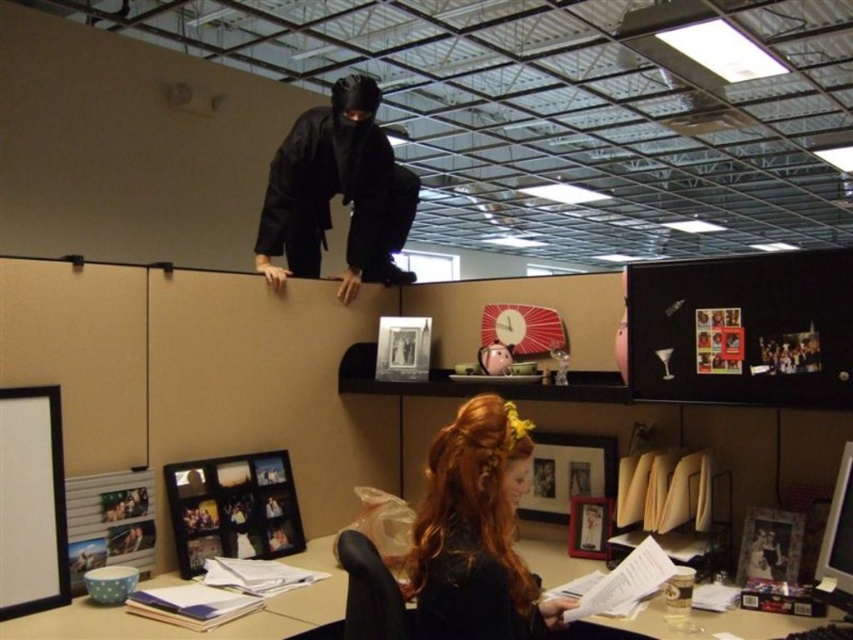
You are an office security camera observing the shiny brown hair at lower center and the wooden desk at lower center. Which object is closer to the camera?

The shiny brown hair at lower center is positioned over the wooden desk at lower center, so it is closer to the camera.

Looking at this image, you are an office security guard who needs to determine if the black matte ninja at upper center can fit through the space between the wooden desk at lower center and the cubicle wall. Based on their relative sizes, can the ninja pass through?

The black matte ninja at upper center is thinner than the wooden desk at lower center, so the ninja can likely pass through the space between the desk and the cubicle wall since its width is narrower than the desk.

You are an office security guard who just noticed the shiny brown hair at lower center and the black matte ninja at upper center. Based on their positions, can you determine which one is closer to the floor?

The shiny brown hair at lower center is positioned under the black matte ninja at upper center, so the shiny brown hair at lower center is closer to the floor.